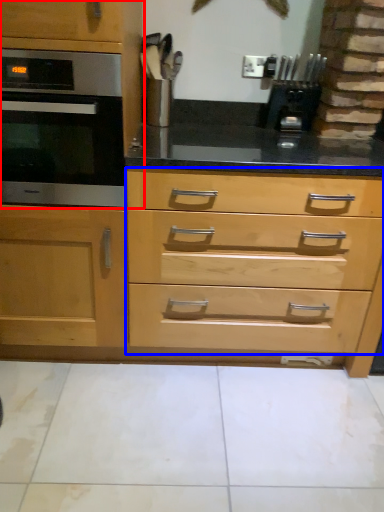
Question: Which object appears closest to the camera in this image, cabinetry (highlighted by a red box) or drawer (highlighted by a blue box)?

Choices:
 (A) cabinetry
 (B) drawer

Answer: (A)